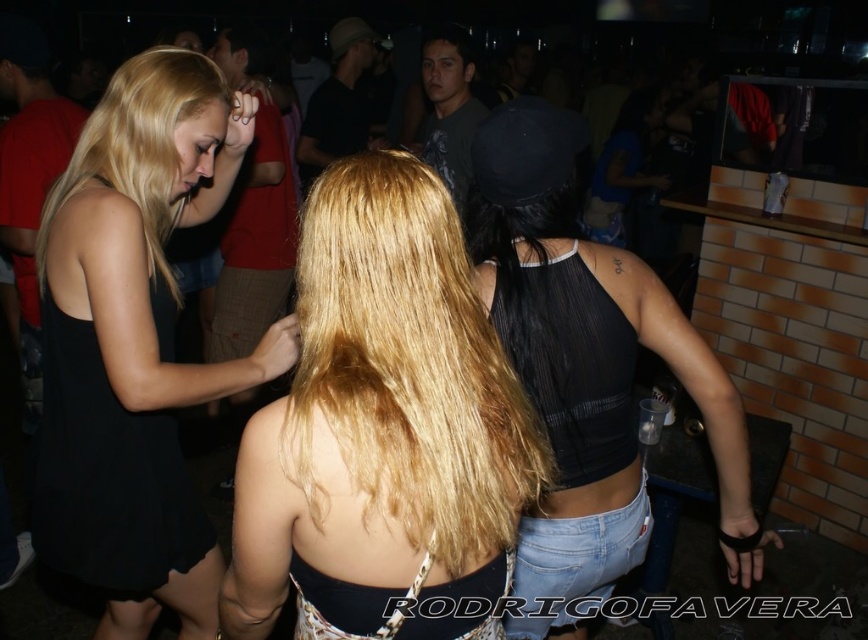
Is point (561, 164) in front of point (102, 163)?

Yes, it is.

Is point (564, 593) behind point (109, 132)?

That is True.

Is point (582, 458) more distant than point (178, 84)?

That is True.

You are a GUI agent. You are given a task and a screenshot of the screen. Output one action in this format:
    pyautogui.click(x=<x>, y=<y>)
    Task: Click on the black mesh tank top at center
    
    Given the screenshot: What is the action you would take?
    pyautogui.click(x=589, y=360)

Who is taller, black sleeveless dress at left or blonde silky hair at upper left?

black sleeveless dress at left

Who is more distant from viewer, (x=120, y=568) or (x=110, y=76)?

Positioned behind is point (x=110, y=76).

Identify the location of black sleeveless dress at left. (136, 342).

Between blonde hair at center and black sleeveless dress at left, which one appears on the right side from the viewer's perspective?

Positioned to the right is blonde hair at center.

What do you see at coordinates (380, 406) in the screenshot? I see `blonde hair at center` at bounding box center [380, 406].

Which is in front, point (357, 291) or point (172, 179)?

Point (357, 291) is more forward.

At what (x,y) coordinates should I click in order to perform the action: click on blonde hair at center. Please return your answer as a coordinate pair (x, y). This screenshot has height=640, width=868. Looking at the image, I should click on (380, 406).